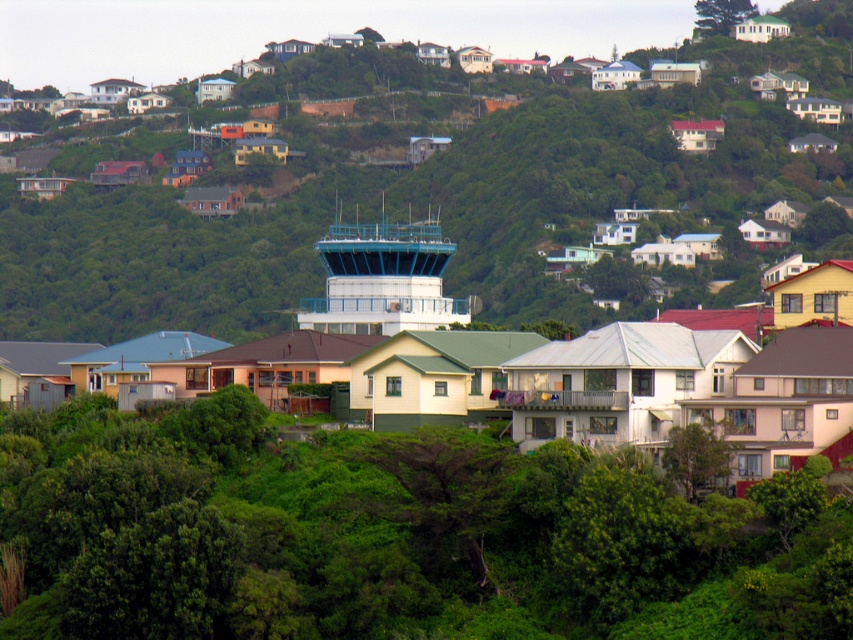
You are standing at the point with coordinates 0.3,0.3 in the image. Which direction should you move to reach the white smooth control tower at center?

Since the white smooth control tower at center is located at point (381, 280) and you are at (254, 192), you should move northeast to reach it.

You are a drone operator who needs to fly a drone from your current position to the white smooth control tower at center. Given that the drone has a maximum flight distance of 100 meters, will it be able to reach the tower?

The distance of white smooth control tower at center from viewer is 120.13 meters, which exceeds the drone maximum flight distance of 100 meters. Therefore, the drone cannot reach the tower.

You are standing at the base of the air traffic control tower in the center of the suburban hillside image. You want to walk directly towards the green leafy tree located at point (387, 536). Which direction should you head?

The point (387, 536) corresponds to the green leafy tree at center, so you should head towards the center direction.